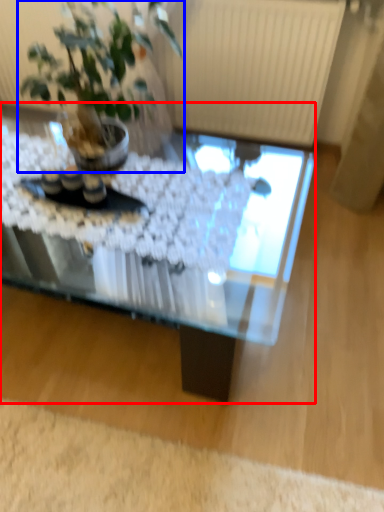
Question: Among these objects, which one is farthest to the camera, coffee table (highlighted by a red box) or houseplant (highlighted by a blue box)?

Choices:
 (A) coffee table
 (B) houseplant

Answer: (A)